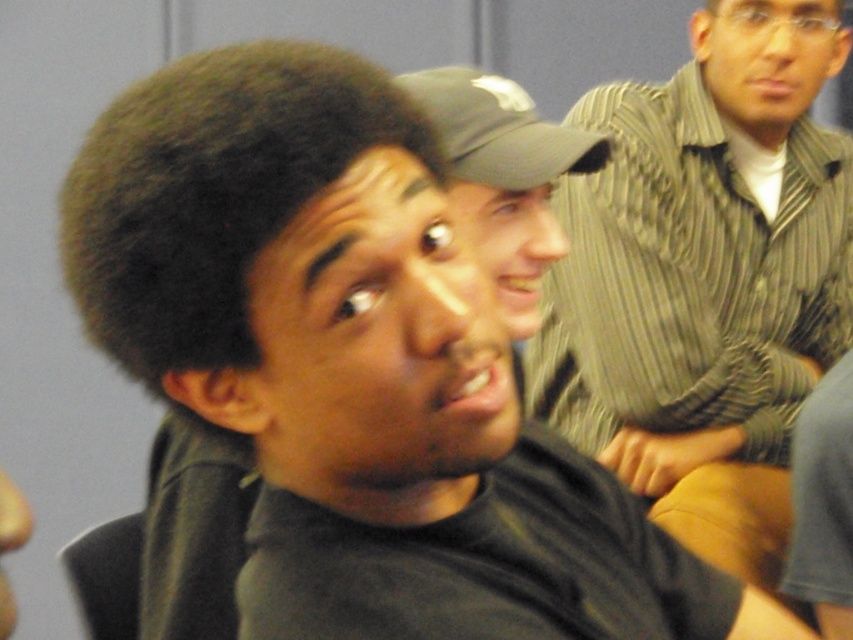
Question: Which of the following is the closest to the observer?

Choices:
 (A) (469, 164)
 (B) (643, 196)

Answer: (A)

Question: Which point appears farthest from the camera in this image?

Choices:
 (A) [x=776, y=509]
 (B) [x=468, y=67]

Answer: (B)

Question: Is striped button-up shirt at upper right behind dark gray fabric baseball cap at upper center?

Choices:
 (A) no
 (B) yes

Answer: (B)

Question: Is striped button-up shirt at upper right to the left of dark gray fabric baseball cap at upper center from the viewer's perspective?

Choices:
 (A) no
 (B) yes

Answer: (A)

Question: Can you confirm if striped button-up shirt at upper right is smaller than dark gray fabric baseball cap at upper center?

Choices:
 (A) no
 (B) yes

Answer: (A)

Question: Which point is closer to the camera taking this photo?

Choices:
 (A) (749, 332)
 (B) (512, 180)

Answer: (B)